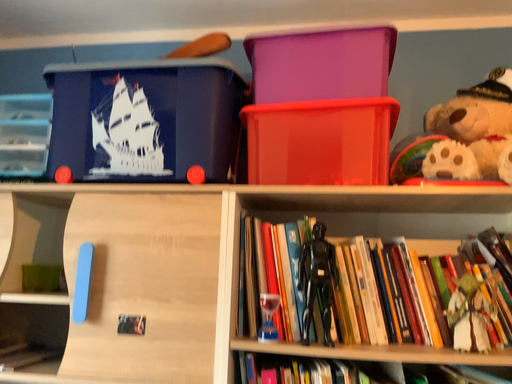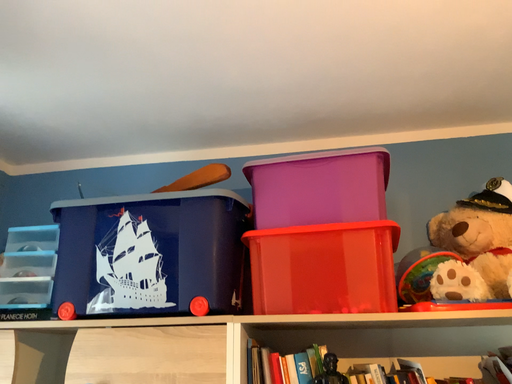
Question: How did the camera likely rotate when shooting the video?

Choices:
 (A) rotated upward
 (B) rotated downward

Answer: (A)